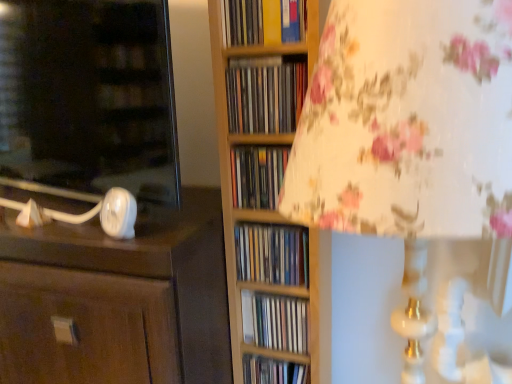
Question: Can you confirm if yellow paperback book at upper center, positioned as the first book in top-to-bottom order, is shorter than matte plastic books at center, the 1th book from the bottom?

Choices:
 (A) no
 (B) yes

Answer: (A)

Question: Could you tell me if yellow paperback book at upper center, acting as the sixth book starting from the bottom, is turned towards matte plastic books at center, the 1th book from the bottom?

Choices:
 (A) no
 (B) yes

Answer: (A)

Question: Is yellow paperback book at upper center, acting as the sixth book starting from the bottom, completely or partially outside of matte plastic books at center, the 1th book from the bottom?

Choices:
 (A) no
 (B) yes

Answer: (B)

Question: From a real-world perspective, is yellow paperback book at upper center, acting as the sixth book starting from the bottom, over matte plastic books at center, the 1th book from the bottom?

Choices:
 (A) no
 (B) yes

Answer: (B)

Question: Is yellow paperback book at upper center, positioned as the first book in top-to-bottom order, bigger than matte plastic books at center, which ranks as the sixth book in top-to-bottom order?

Choices:
 (A) no
 (B) yes

Answer: (B)

Question: From the image's perspective, is matte plastic books at center, which appears as the 3th book when ordered from the bottom, above or below matte white lamp base at left?

Choices:
 (A) below
 (B) above

Answer: (A)

Question: Does point (292, 251) appear closer or farther from the camera than point (36, 16)?

Choices:
 (A) closer
 (B) farther

Answer: (B)

Question: Based on their sizes in the image, would you say matte plastic books at center, which appears as the 3th book when ordered from the bottom, is bigger or smaller than matte white lamp base at left?

Choices:
 (A) small
 (B) big

Answer: (A)

Question: Based on their positions, is matte plastic books at center, which appears as the 4th book when viewed from the top, located to the left or right of matte white lamp base at left?

Choices:
 (A) left
 (B) right

Answer: (B)

Question: From their relative heights in the image, would you say matte plastic books at center, the 1th book from the bottom, is taller or shorter than yellow paperback book at upper center, positioned as the first book in top-to-bottom order?

Choices:
 (A) tall
 (B) short

Answer: (B)

Question: Is matte plastic books at center, which ranks as the sixth book in top-to-bottom order, wider or thinner than yellow paperback book at upper center, acting as the sixth book starting from the bottom?

Choices:
 (A) wide
 (B) thin

Answer: (B)

Question: Is point (260, 367) positioned closer to the camera than point (241, 16)?

Choices:
 (A) closer
 (B) farther

Answer: (B)

Question: Considering their positions, is matte plastic books at center, the 1th book from the bottom, located in front of or behind yellow paperback book at upper center, positioned as the first book in top-to-bottom order?

Choices:
 (A) front
 (B) behind

Answer: (B)

Question: Is matte plastic books at center, which appears as the 3th book when ordered from the bottom, wider or thinner than matte plastic books at center, placed as the 3th book when sorted from top to bottom?

Choices:
 (A) wide
 (B) thin

Answer: (A)

Question: Is matte plastic books at center, which appears as the 3th book when ordered from the bottom, inside or outside of matte plastic books at center, the 4th book from the bottom?

Choices:
 (A) outside
 (B) inside

Answer: (A)